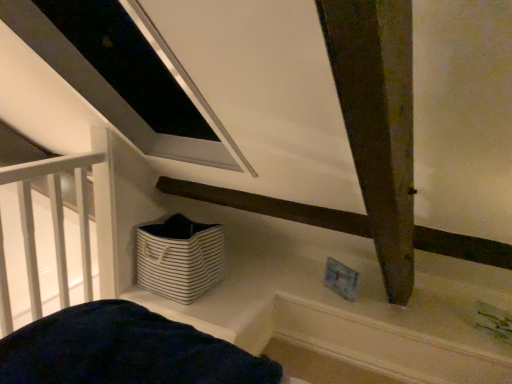
The width and height of the screenshot is (512, 384). What do you see at coordinates (179, 258) in the screenshot?
I see `white striped fabric basket at lower left` at bounding box center [179, 258].

What are the coordinates of `white striped fabric basket at lower left` in the screenshot? It's located at (179, 258).

This screenshot has height=384, width=512. In order to click on white striped fabric basket at lower left in this screenshot , I will do [x=179, y=258].